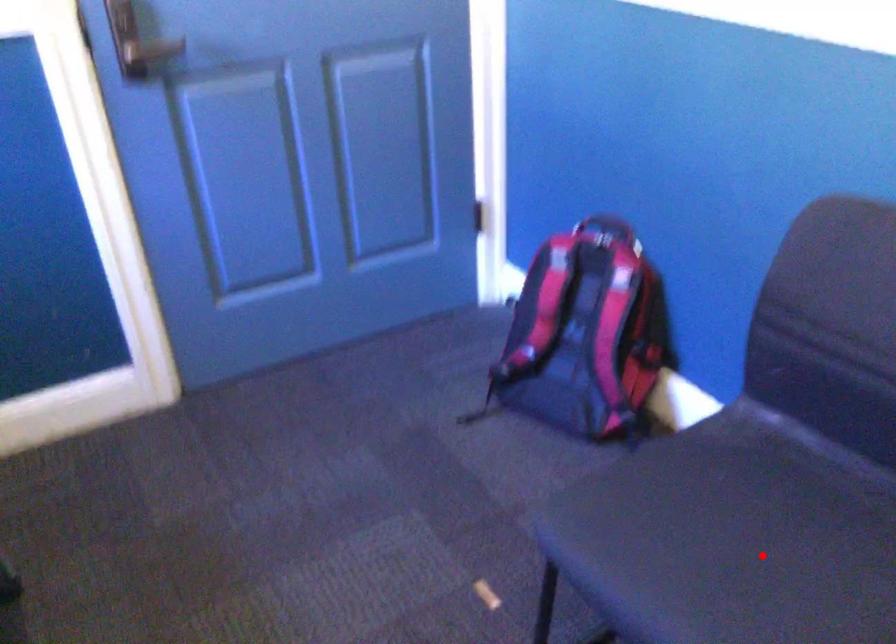
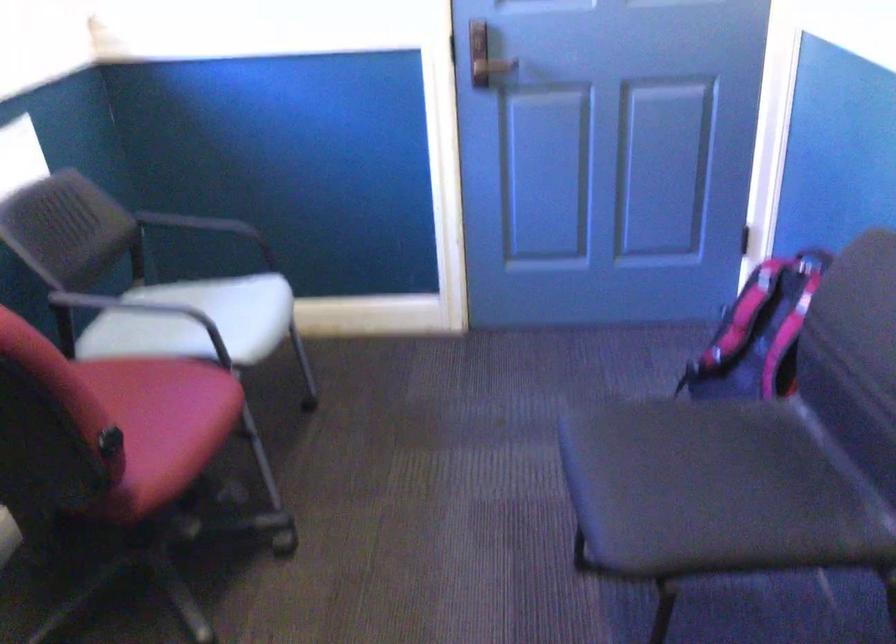
Question: I am providing you with two images of the same scene from different viewpoints. In image1, a red point is highlighted. Considering the same 3D point in image2, which of the following is correct?

Choices:
 (A) It is closer
 (B) It is farther

Answer: (B)